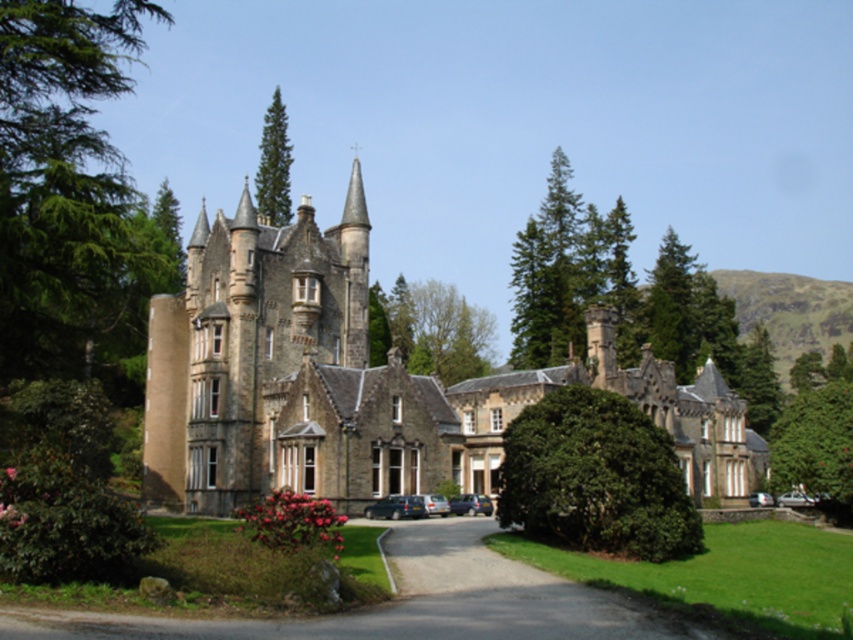
You are a visitor arriving at the historic building and need to park your car. You see the gravel driveway at center and the metallic gray car at center. Which side of the driveway should you park on to avoid blocking the entrance?

You should park the metallic gray car at center on the left side of the gravel driveway at center since the driveway is to the right of the car, indicating the entrance is likely on that side and parking to the left would keep the entrance clear.

You are a delivery driver trying to park your metallic silver car at center in front of the grand building. There is a green leafy tree at center in the way. Can you drive around it on the left side?

The green leafy tree at center might be wider than metallic silver car at center, so it is uncertain if there is enough space to drive around it on the left side. You should check the width before attempting to maneuver.

You need to park your metallic gray car at center in the gravel driveway at center. Is there enough space for the car to fit completely on the driveway?

The gravel driveway at center is bigger than the metallic gray car at center, so yes, there is enough space for the metallic gray car at center to fit completely on the driveway.